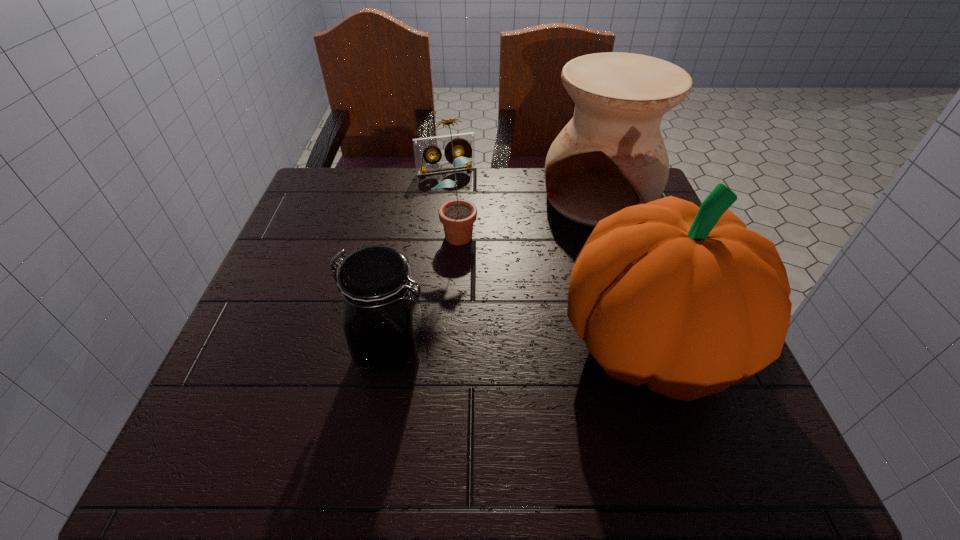
Image resolution: width=960 pixels, height=540 pixels. I want to click on the second shortest object, so click(x=382, y=321).

The width and height of the screenshot is (960, 540). What are the coordinates of `pumpkin` in the screenshot? It's located at (685, 299).

Where is `sunflower`? sunflower is located at coordinates (457, 216).

Where is `pottery`? This screenshot has height=540, width=960. pottery is located at coordinates (611, 155).

Locate an element on the screen. This screenshot has width=960, height=540. the shortest object is located at coordinates point(465,142).

Find the location of a particular element. The width and height of the screenshot is (960, 540). free space located 0.090m on the lid of the fourth tallest object is located at coordinates (302, 349).

I want to click on vacant area situated on the lid of the fourth tallest object, so click(237, 349).

Identify the location of vacant region located on the lid of the fourth tallest object. point(307,349).

The height and width of the screenshot is (540, 960). Identify the location of free space located 0.360m on the back of the pumpkin. (596, 185).

You are a GUI agent. You are given a task and a screenshot of the screen. Output one action in this format:
    pyautogui.click(x=<x>, y=<y>)
    Task: Click on the free location located 0.280m on the flower of the sunflower
    The image size is (960, 540).
    Given the screenshot: What is the action you would take?
    click(x=492, y=345)